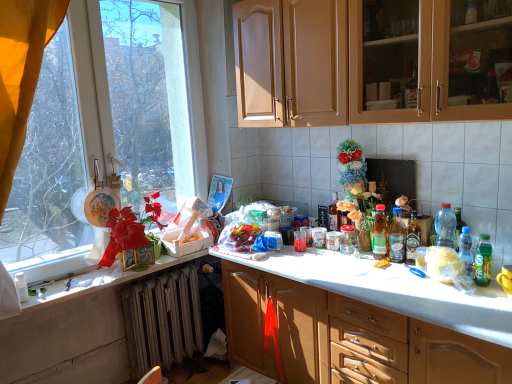
Question: Looking at the image, does matte wood cabinets at upper center, acting as the first cabinetry starting from the top, seem bigger or smaller compared to translucent plastic bottle at right, arranged as the 5th bottle when viewed from the left?

Choices:
 (A) small
 (B) big

Answer: (B)

Question: From the image's perspective, is matte wood cabinets at upper center, marked as the 2th cabinetry in a bottom-to-top arrangement, positioned above or below translucent plastic bottle at right, marked as the second bottle in a front-to-back arrangement?

Choices:
 (A) above
 (B) below

Answer: (A)

Question: Estimate the real-world distances between objects in this image. Which object is farther from the translucent glass bottle at center, marked as the third bottle in a left-to-right arrangement?

Choices:
 (A) matte brown cabinets at center, which appears as the 2th cabinetry when viewed from the top
 (B) matte white counter top at left
 (C) transparent glass window at upper left
 (D) translucent glass bottle at center, which ranks as the 5th bottle in right-to-left order
 (E) translucent plastic bottle at right, the 4th bottle positioned from the back

Answer: (C)

Question: Estimate the real-world distances between objects in this image. Which object is farther from the translucent glass bottle at center, the 1th bottle in the left-to-right sequence?

Choices:
 (A) translucent glass bottle at center, which is counted as the 2th bottle, starting from the back
 (B) translucent plastic bottle at right, marked as the 2th bottle in a right-to-left arrangement
 (C) green matte bottle at right, acting as the 6th bottle starting from the back
 (D) gray metallic radiator at lower left
 (E) translucent plastic bottle at right, which ranks as the fourth bottle in left-to-right order

Answer: (D)